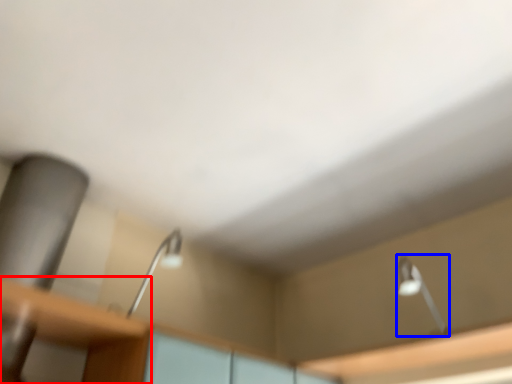
Question: Which object appears farthest to the camera in this image, table (highlighted by a red box) or lamp (highlighted by a blue box)?

Choices:
 (A) table
 (B) lamp

Answer: (B)